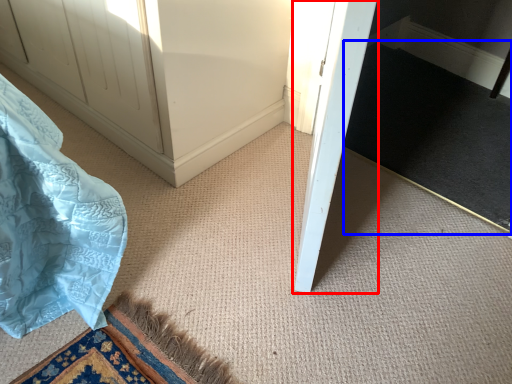
Question: Which object appears farthest to the camera in this image, door (highlighted by a red box) or doormat (highlighted by a blue box)?

Choices:
 (A) door
 (B) doormat

Answer: (B)